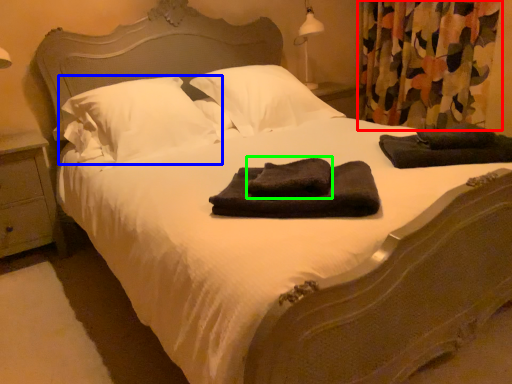
Question: Which object is the closest to the curtain (highlighted by a red box)? Choose among these: pillow (highlighted by a blue box) or bath towel (highlighted by a green box).

Choices:
 (A) pillow
 (B) bath towel

Answer: (A)